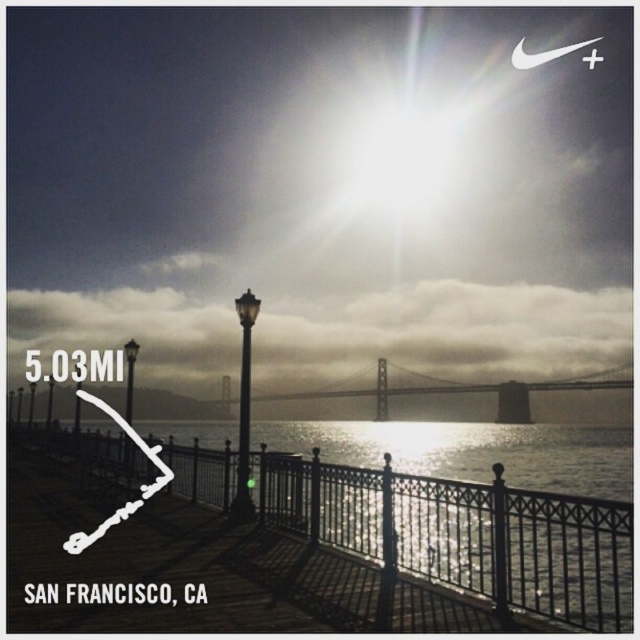
Is matte black lamp post at center taller than black glass lamp post at center?

In fact, matte black lamp post at center may be shorter than black glass lamp post at center.

Does matte black lamp post at center have a smaller size compared to black glass lamp post at center?

Correct, matte black lamp post at center occupies less space than black glass lamp post at center.

Which is behind, point (234, 508) or point (129, 381)?

Point (129, 381)

Locate an element on the screen. Image resolution: width=640 pixels, height=640 pixels. matte black lamp post at center is located at coordinates pos(244,408).

Is point (580, 582) positioned after point (124, 460)?

No.

Is metallic black railing at lower center to the right of black glass lamp post at center from the viewer's perspective?

Yes, metallic black railing at lower center is to the right of black glass lamp post at center.

Between point (384, 531) and point (124, 355), which one is positioned in front?

Point (384, 531) is in front.

Where is `metallic black railing at lower center`? The image size is (640, 640). metallic black railing at lower center is located at coordinates (464, 534).

At what (x,y) coordinates should I click in order to perform the action: click on metallic black railing at lower center. Please return your answer as a coordinate pair (x, y). The width and height of the screenshot is (640, 640). Looking at the image, I should click on pyautogui.click(x=464, y=534).

Between point (611, 515) and point (240, 388), which one is positioned in front?

Point (611, 515) is more forward.

The image size is (640, 640). I want to click on metallic black railing at lower center, so click(x=464, y=534).